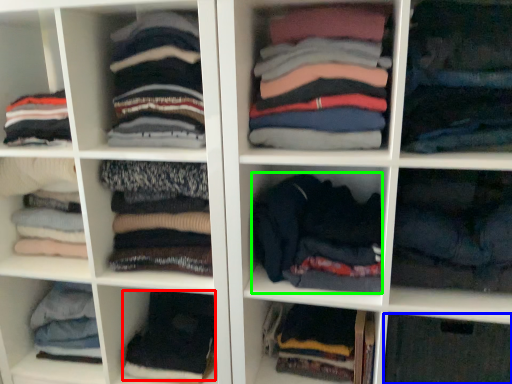
Question: Based on their relative distances, which object is farther from clothing (highlighted by a red box)? Choose from cabinet (highlighted by a blue box) and clothing (highlighted by a green box).

Choices:
 (A) cabinet
 (B) clothing

Answer: (A)